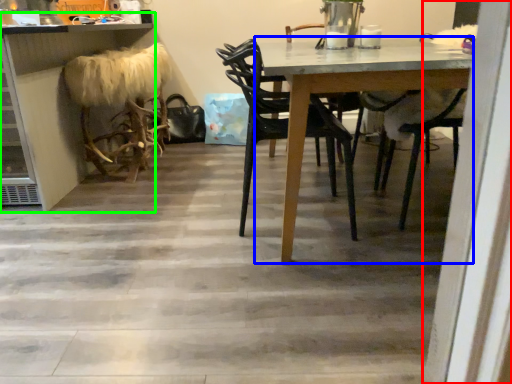
Question: Which object is positioned farthest from screen door (highlighted by a red box)? Select from table (highlighted by a blue box) and counter (highlighted by a green box).

Choices:
 (A) table
 (B) counter

Answer: (B)